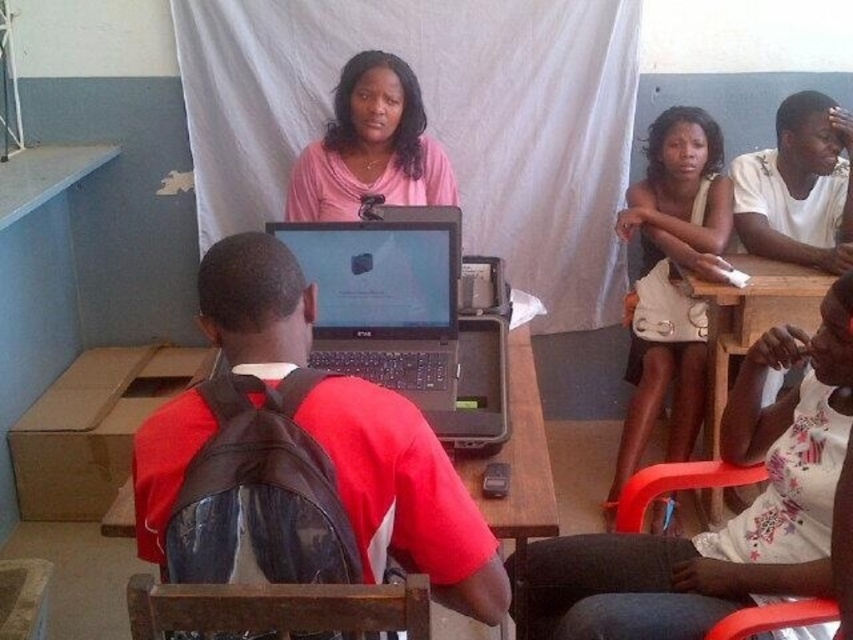
You are sitting at the wooden table at center and want to reach the black matte laptop at center. Can you easily reach it without moving your seat?

The black matte laptop at center is closer to the viewer than wooden table at center, so yes, you can easily reach it without moving your seat since it is positioned nearer to you.

You are standing at the point labeled as point (805, 282) and want to move to the point labeled as point (628, 621). Is the path between these two points clear of any obstacles?

The point (628, 621) is in front of point (805, 282), so the path between them is clear of obstacles.

You are organizing a classroom activity and need to place a large poster on the surface that can accommodate it. Between the black matte laptop at center and the wooden table at center, which object would be more suitable for placing the poster?

The wooden table at center is larger than the black matte laptop at center, so it would be more suitable for placing the large poster.